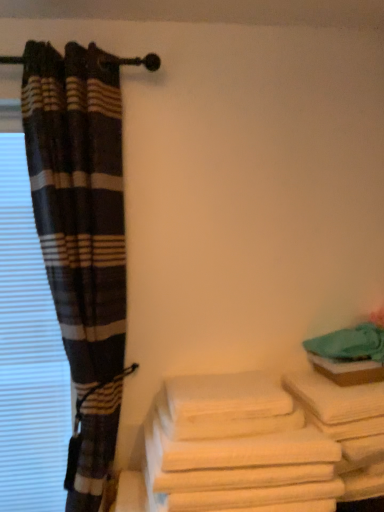
Question: From the image's perspective, is white cotton towels at lower right above white cotton bath towel at lower right?

Choices:
 (A) no
 (B) yes

Answer: (A)

Question: From a real-world perspective, is white cotton towels at lower right physically above white cotton bath towel at lower right?

Choices:
 (A) no
 (B) yes

Answer: (A)

Question: From the image's perspective, does white cotton towels at lower right appear lower than white cotton bath towel at lower right?

Choices:
 (A) no
 (B) yes

Answer: (B)

Question: Is white cotton towels at lower right closer to the viewer compared to white cotton bath towel at lower right?

Choices:
 (A) no
 (B) yes

Answer: (B)

Question: Is white cotton towels at lower right aimed at white cotton bath towel at lower right?

Choices:
 (A) no
 (B) yes

Answer: (A)

Question: Considering the relative sizes of white cotton towels at lower right and white cotton bath towel at lower right in the image provided, is white cotton towels at lower right shorter than white cotton bath towel at lower right?

Choices:
 (A) no
 (B) yes

Answer: (A)

Question: Is white cotton bath towel at lower right not close to white cotton towels at lower right?

Choices:
 (A) no
 (B) yes

Answer: (A)

Question: Is white cotton towels at lower right a part of white cotton bath towel at lower right?

Choices:
 (A) no
 (B) yes

Answer: (A)

Question: Is white cotton bath towel at lower right wider than white cotton towels at lower right?

Choices:
 (A) yes
 (B) no

Answer: (B)

Question: From a real-world perspective, is white cotton bath towel at lower right located beneath white cotton towels at lower right?

Choices:
 (A) yes
 (B) no

Answer: (B)

Question: Is white cotton bath towel at lower right aimed at white cotton towels at lower right?

Choices:
 (A) yes
 (B) no

Answer: (B)

Question: Is white cotton bath towel at lower right further to the viewer compared to white cotton towels at lower right?

Choices:
 (A) no
 (B) yes

Answer: (B)

Question: Is white cotton towels at lower right shorter than white blinds at left?

Choices:
 (A) no
 (B) yes

Answer: (B)